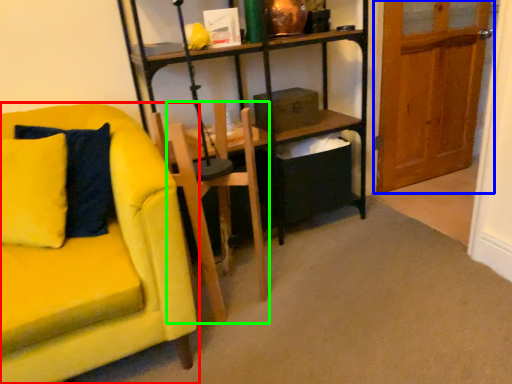
Question: Which is nearer to the chair (highlighted by a red box)? door (highlighted by a blue box) or armchair (highlighted by a green box).

Choices:
 (A) door
 (B) armchair

Answer: (B)